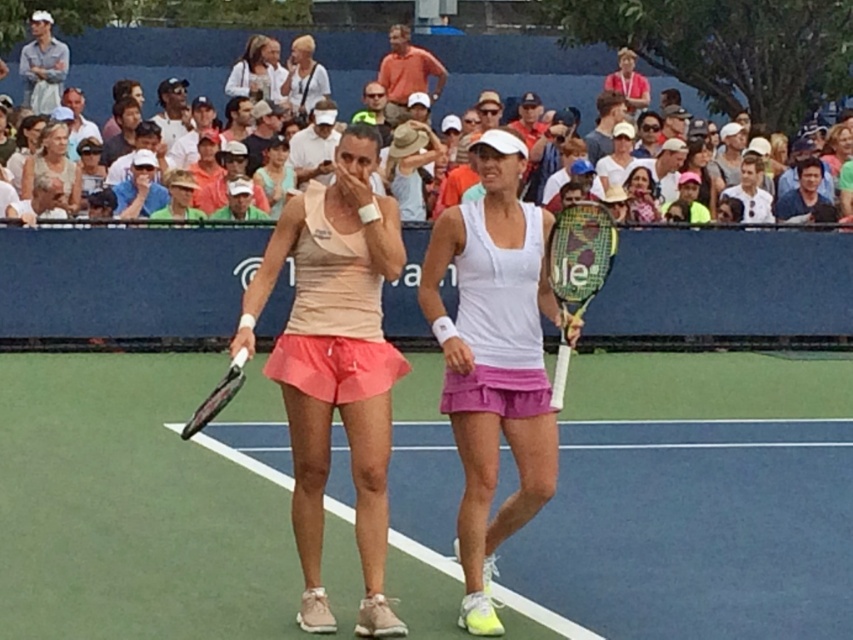
You are a tennis ball that just bounced near the center of the court. You want to roll towards the white textured racket at center. Which direction should you move to reach it?

Since the white textured racket at center is located at point 0.423 on the x and 0.678 on the y, you should move towards the center of the court to reach it.

In the scene shown: You are a tennis player standing on the court and see the white textured racket at center. Your opponent is 7.95 meters away from you. Can you hit the tennis ball to reach them in one serve?

The distance between you and your opponent is 7.95 meters. A standard tennis court is 23.77 meters long, so 7.95 meters is well within the court length. However, serving requires hitting the ball over the net into the service box, which is typically about 6.4 meters from the baseline. If you are positioned at the baseline, your serve needs to reach approximately 6.4 meters, but your opponent is farther away at 7.95 meters. Therefore, yes, you can hit the ball to reach them as the distance is achievable with